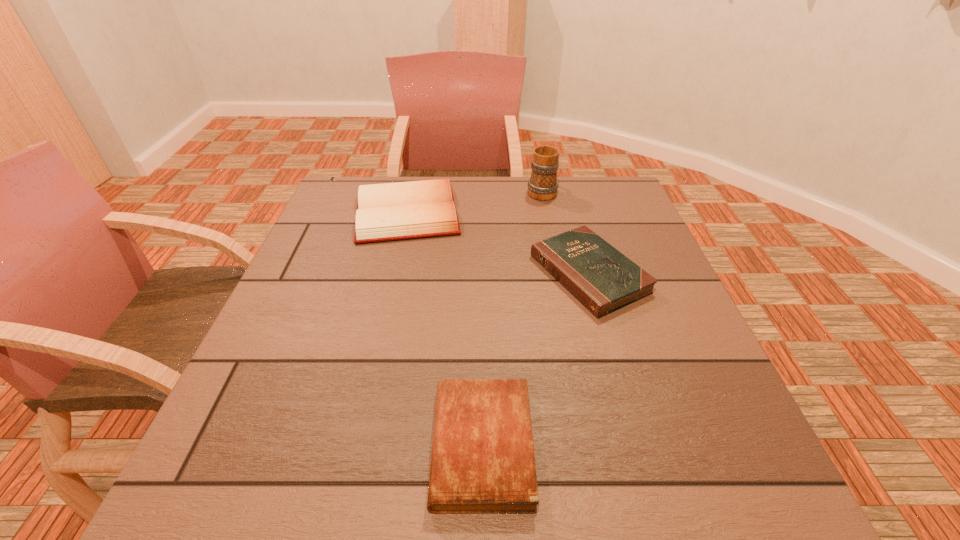
The image size is (960, 540). I want to click on object that is at the left edge, so click(x=404, y=210).

Locate an element on the screen. object at the right edge is located at coordinates (601, 278).

The width and height of the screenshot is (960, 540). What are the coordinates of `object that is positioned at the far left corner` in the screenshot? It's located at (404, 210).

The image size is (960, 540). I want to click on vacant space at the far edge of the desktop, so click(x=539, y=207).

I want to click on vacant area at the left edge, so click(x=316, y=246).

Image resolution: width=960 pixels, height=540 pixels. Identify the location of free space at the right edge. (647, 392).

Find the location of `free space at the near left corner`. free space at the near left corner is located at coordinates click(x=292, y=460).

Identify the location of free space at the far right corner of the desktop. Image resolution: width=960 pixels, height=540 pixels. (606, 214).

I want to click on vacant space at the near right corner, so click(x=680, y=479).

This screenshot has width=960, height=540. I want to click on free spot between the nearest Bible and the mug, so click(x=512, y=318).